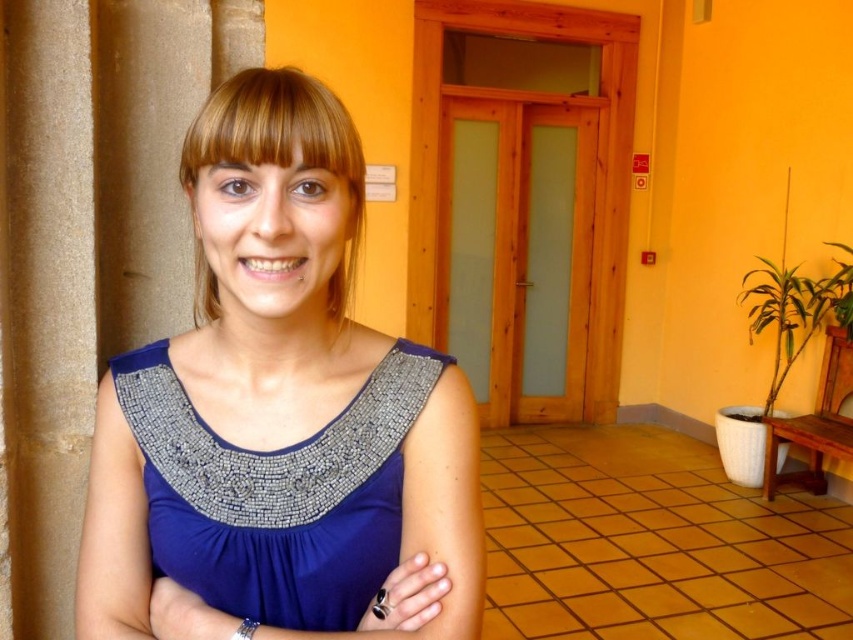
Is brown stone pillar at left further to the viewer compared to blue satin dress at center?

Yes, it is behind blue satin dress at center.

Between brown stone pillar at left and blue satin dress at center, which one appears on the right side from the viewer's perspective?

blue satin dress at center

Does point (7, 433) come farther from viewer compared to point (305, 586)?

Yes, point (7, 433) is behind point (305, 586).

Where is `brown stone pillar at left`? The height and width of the screenshot is (640, 853). brown stone pillar at left is located at coordinates (90, 237).

Is blue fabric dress at center smaller than silver metallic bracelet at lower center?

No.

Is blue fabric dress at center above silver metallic bracelet at lower center?

Indeed, blue fabric dress at center is positioned over silver metallic bracelet at lower center.

Between point (368, 577) and point (244, 627), which one is positioned in front?

Point (244, 627) is more forward.

This screenshot has width=853, height=640. In order to click on blue fabric dress at center in this screenshot , I will do `click(277, 412)`.

Is brown stone pillar at left thinner than silver metallic bracelet at lower center?

No, brown stone pillar at left is not thinner than silver metallic bracelet at lower center.

Between point (120, 250) and point (244, 625), which one is positioned in front?

Point (244, 625)

What do you see at coordinates (90, 237) in the screenshot? The width and height of the screenshot is (853, 640). I see `brown stone pillar at left` at bounding box center [90, 237].

The width and height of the screenshot is (853, 640). I want to click on brown stone pillar at left, so click(x=90, y=237).